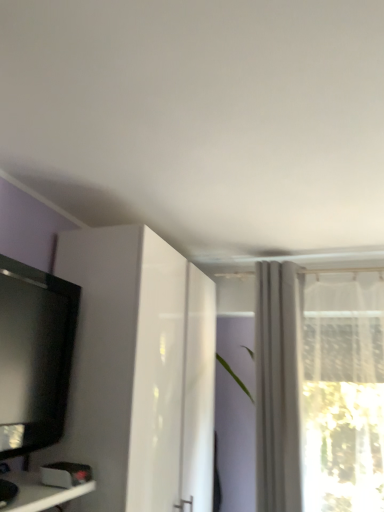
Locate an element on the screen. The width and height of the screenshot is (384, 512). white glossy cabinet at left is located at coordinates coord(140,370).

The image size is (384, 512). Find the location of `white glossy cabinet at left`. white glossy cabinet at left is located at coordinates (140, 370).

Is black glossy television at left turned away from white glossy cabinet at left?

No, black glossy television at left is not facing away from white glossy cabinet at left.

In order to click on cabinetry that is on the right side of black glossy television at left in this screenshot , I will do pos(140,370).

From the image's perspective, between black glossy television at left and white glossy cabinet at left, which one is located above?

black glossy television at left, from the image's perspective.

Would you say black glossy television at left is outside white glossy cabinet at left?

Yes, black glossy television at left is outside of white glossy cabinet at left.

Considering their positions, is white sheer curtain at upper right located in front of or behind black glossy television at left?

Visually, white sheer curtain at upper right is located behind black glossy television at left.

From a real-world perspective, does white sheer curtain at upper right stand above black glossy television at left?

Indeed, from a real-world perspective, white sheer curtain at upper right stands above black glossy television at left.

Is white sheer curtain at upper right not within black glossy television at left?

Yes.

Measure the distance between white glossy cabinet at left and white sheer curtain at upper right.

white glossy cabinet at left and white sheer curtain at upper right are 54.19 centimeters apart from each other.

Is there a large distance between white glossy cabinet at left and white sheer curtain at upper right?

That's not correct — white glossy cabinet at left is a little close to white sheer curtain at upper right.

Is white glossy cabinet at left turned away from white sheer curtain at upper right?

white glossy cabinet at left is not turned away from white sheer curtain at upper right.

From the image's perspective, between white glossy cabinet at left and white sheer curtain at upper right, who is located below?

white glossy cabinet at left, from the image's perspective.

Is white glossy cabinet at left in front of or behind black glossy television at left in the image?

In the image, white glossy cabinet at left appears behind black glossy television at left.

From the picture: From a real-world perspective, is white glossy cabinet at left under black glossy television at left?

Yes, from a real-world perspective, white glossy cabinet at left is beneath black glossy television at left.

Considering the relative sizes of white glossy cabinet at left and black glossy television at left in the image provided, is white glossy cabinet at left bigger than black glossy television at left?

Correct, white glossy cabinet at left is larger in size than black glossy television at left.

Find the location of `television above the white glossy cabinet at left (from a real-world perspective)`. television above the white glossy cabinet at left (from a real-world perspective) is located at coordinates (34, 356).

Considering their positions, is white sheer curtain at upper right located in front of or behind white glossy cabinet at left?

white sheer curtain at upper right is behind white glossy cabinet at left.

Considering the relative sizes of white sheer curtain at upper right and white glossy cabinet at left in the image provided, is white sheer curtain at upper right shorter than white glossy cabinet at left?

Correct, white sheer curtain at upper right is not as tall as white glossy cabinet at left.

Is white sheer curtain at upper right wider than white glossy cabinet at left?

No, white sheer curtain at upper right is not wider than white glossy cabinet at left.

Between white sheer curtain at upper right and white glossy cabinet at left, which one appears on the left side from the viewer's perspective?

white glossy cabinet at left is more to the left.

Is black glossy television at left at the right side of white sheer curtain at upper right?

Incorrect, black glossy television at left is not on the right side of white sheer curtain at upper right.

Is black glossy television at left spatially inside white sheer curtain at upper right, or outside of it?

black glossy television at left is located beyond the bounds of white sheer curtain at upper right.

Considering their positions, is black glossy television at left located in front of or behind white sheer curtain at upper right?

Visually, black glossy television at left is located in front of white sheer curtain at upper right.

From the picture: Could you tell me if black glossy television at left is turned towards white sheer curtain at upper right?

No.

The image size is (384, 512). I want to click on cabinetry below the black glossy television at left (from the image's perspective), so click(140, 370).

Locate an element on the screen. The image size is (384, 512). television above the white sheer curtain at upper right (from the image's perspective) is located at coordinates click(x=34, y=356).

Based on their spatial positions, is white glossy cabinet at left or black glossy television at left closer to white sheer curtain at upper right?

The object closer to white sheer curtain at upper right is white glossy cabinet at left.

Looking at the image, which one is located further to white glossy cabinet at left, black glossy television at left or white sheer curtain at upper right?

Among the two, white sheer curtain at upper right is located further to white glossy cabinet at left.

Based on their spatial positions, is white sheer curtain at upper right or black glossy television at left further from white glossy cabinet at left?

white sheer curtain at upper right is further to white glossy cabinet at left.

Looking at the image, which one is located closer to black glossy television at left, white sheer curtain at upper right or white glossy cabinet at left?

white glossy cabinet at left is positioned closer to the anchor black glossy television at left.

Which object lies nearer to the anchor point white sheer curtain at upper right, black glossy television at left or white glossy cabinet at left?

white glossy cabinet at left is positioned closer to the anchor white sheer curtain at upper right.

Considering their positions, is white glossy cabinet at left positioned further to black glossy television at left than white sheer curtain at upper right?

white sheer curtain at upper right is positioned further to the anchor black glossy television at left.

I want to click on cabinetry situated between black glossy television at left and white sheer curtain at upper right from left to right, so click(140, 370).